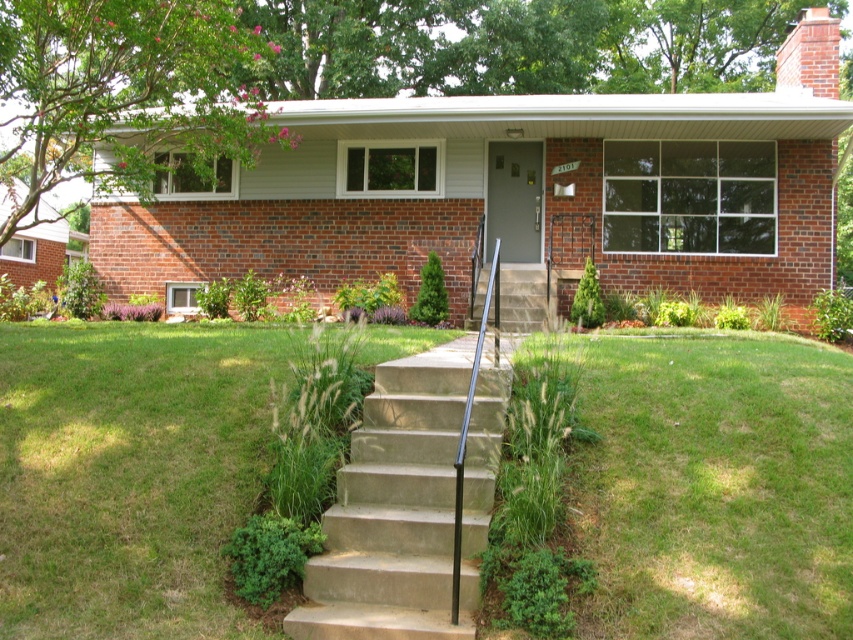
Which is below, green grass at lower center or concrete/steps at center?

concrete/steps at center

Who is positioned more to the right, green grass at lower center or concrete/steps at center?

green grass at lower center

This screenshot has width=853, height=640. Describe the element at coordinates (712, 486) in the screenshot. I see `green grass at lower center` at that location.

Find the location of a particular element. The image size is (853, 640). green grass at lower center is located at coordinates (712, 486).